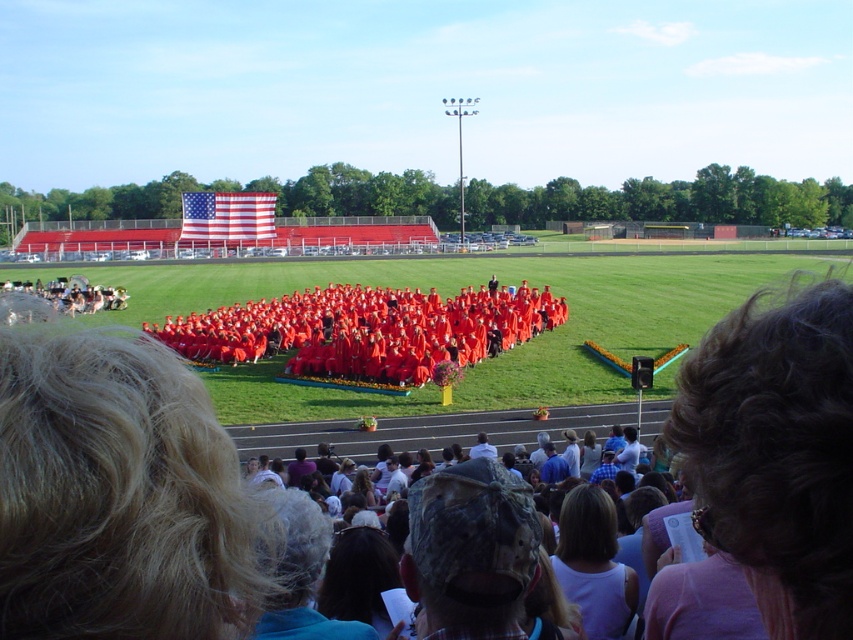
You are a photographer at the graduation ceremony. You need to capture a photo of the graduates in the center while ensuring that the blonde hair at lower left is not in the frame. Based on their positions, is this possible?

The blonde hair at lower left is located at point (x=117, y=493), which is outside the central area where the graduates are seated. Therefore, it is possible to capture a photo of the graduates in the center without including the blonde hair at lower left in the frame.

You are a photographer at the graduation ceremony. You need to capture a photo that includes both the blonde hair at lower left and dark brown hair at lower right. Based on their positions, which one should be placed on the left side of the photo?

The blonde hair at lower left should be placed on the left side of the photo since it is already positioned to the left of the dark brown hair at lower right.

You are a photographer at the graduation ceremony. You need to adjust your camera focus to ensure both the blonde hair at lower left and the dark brown hair at lower right are clearly visible. Which person should you focus on first to account for their height difference?

The photographer should focus on the blonde hair at lower left first because it has a lesser height compared to the dark brown hair at lower right, ensuring proper depth of field for both subjects.